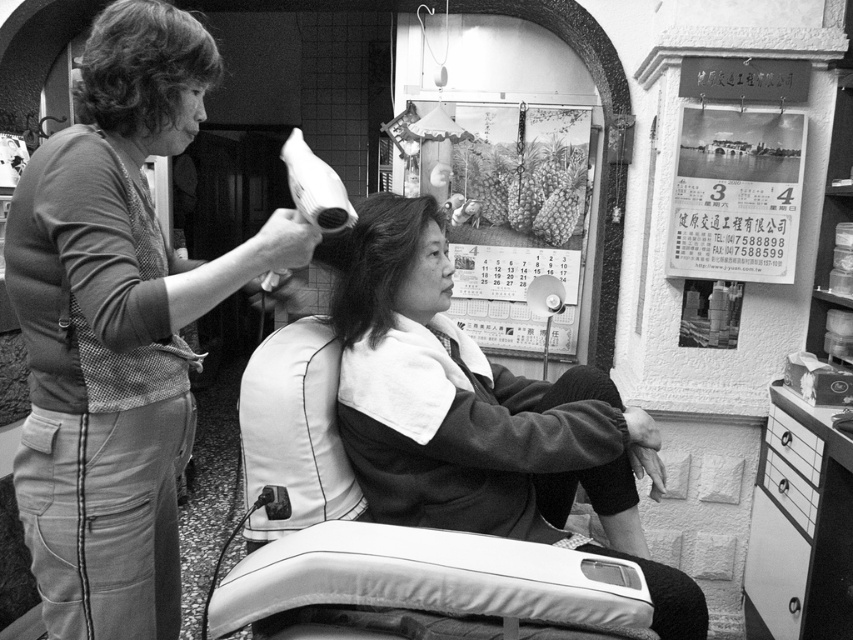
Question: Where is smooth black hair at center located in relation to smooth hair at center in the image?

Choices:
 (A) above
 (B) below

Answer: (B)

Question: Which of these objects is positioned farthest from the smooth black hair at center?

Choices:
 (A) matte gray hairdryer at upper left
 (B) smooth hair at center
 (C) curly hair at upper left

Answer: (C)

Question: Can you confirm if smooth black hair at center is thinner than smooth hair at center?

Choices:
 (A) no
 (B) yes

Answer: (A)

Question: Among these points, which one is nearest to the camera?

Choices:
 (A) (183, 33)
 (B) (328, 266)

Answer: (A)

Question: Which object appears farthest from the camera in this image?

Choices:
 (A) smooth hair at center
 (B) matte gray hairdryer at upper left
 (C) curly hair at upper left

Answer: (A)

Question: Observing the image, what is the correct spatial positioning of matte gray hairdryer at upper left in reference to smooth hair at center?

Choices:
 (A) below
 (B) above

Answer: (A)